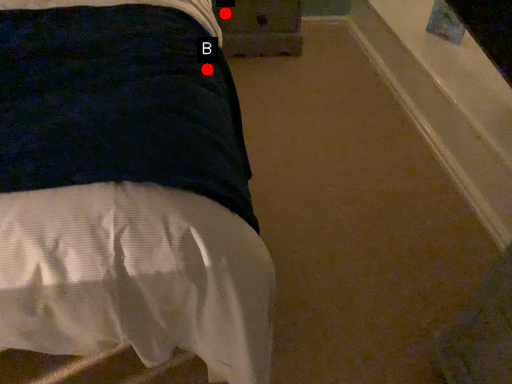
Question: Two points are circled on the image, labeled by A and B beside each circle. Which point is closer to the camera?

Choices:
 (A) A is closer
 (B) B is closer

Answer: (B)